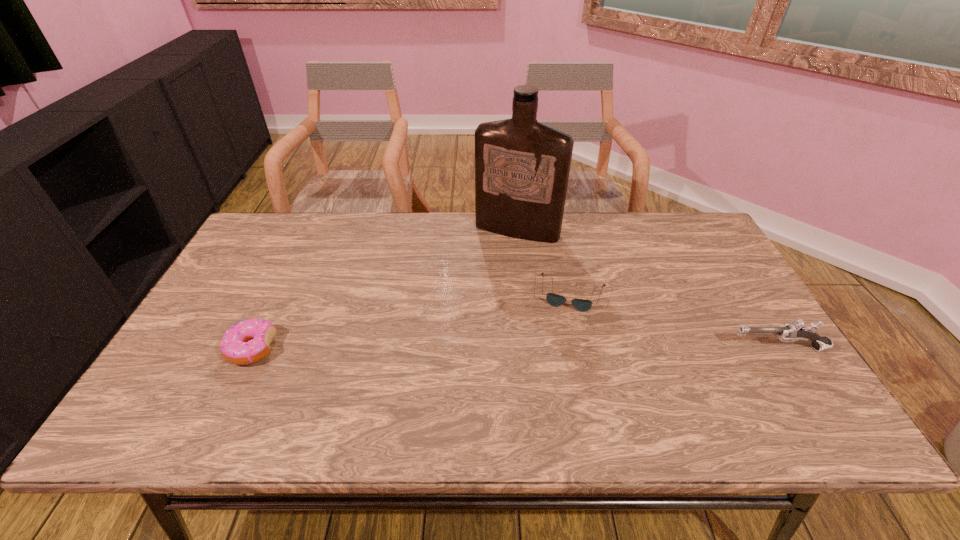
Where is `free spot between the shortest object and the doughnut`? The width and height of the screenshot is (960, 540). free spot between the shortest object and the doughnut is located at coordinates (413, 321).

The image size is (960, 540). Identify the location of empty location between the shortest object and the rightmost object. (676, 321).

At what (x,y) coordinates should I click in order to perform the action: click on free area in between the third shortest object and the shortest object. Please return your answer as a coordinate pair (x, y). Image resolution: width=960 pixels, height=540 pixels. Looking at the image, I should click on coord(676,321).

Where is `free spot between the farthest object and the gun`? The height and width of the screenshot is (540, 960). free spot between the farthest object and the gun is located at coordinates (648, 289).

At what (x,y) coordinates should I click in order to perform the action: click on free space that is in between the gun and the doughnut. Please return your answer as a coordinate pair (x, y). Looking at the image, I should click on (516, 348).

The image size is (960, 540). I want to click on free space between the farthest object and the third shortest object, so click(648, 289).

The height and width of the screenshot is (540, 960). What are the coordinates of `vacant space in between the tallest object and the shortest object` in the screenshot? It's located at (545, 262).

Where is `free spot between the rightmost object and the sunglasses`? This screenshot has width=960, height=540. free spot between the rightmost object and the sunglasses is located at coordinates click(x=676, y=321).

This screenshot has height=540, width=960. I want to click on unoccupied position between the second tallest object and the second farthest object, so click(676, 321).

This screenshot has width=960, height=540. What are the coordinates of `free point between the rightmost object and the shortest object` in the screenshot? It's located at (676, 321).